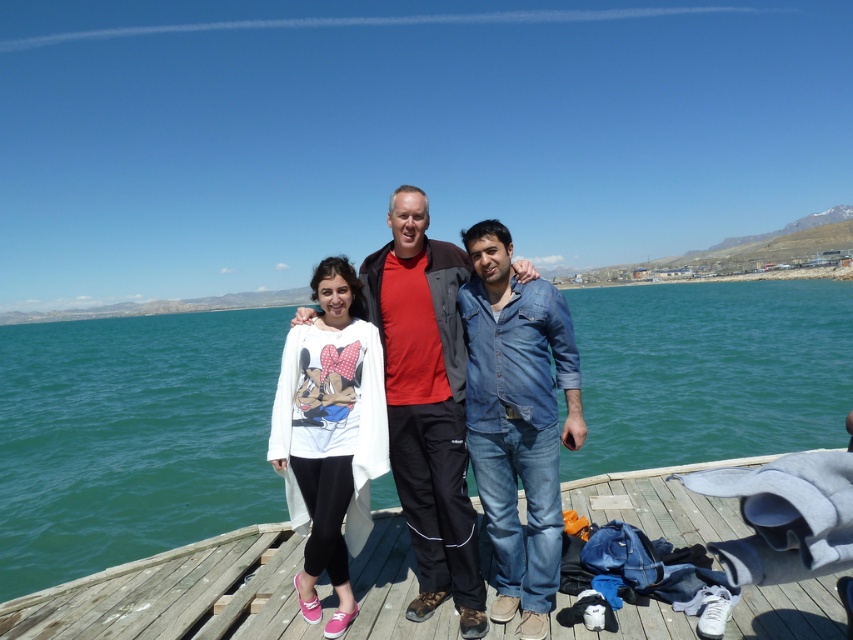
Question: Is denim jeans at lower right above red cotton shirt at center?

Choices:
 (A) yes
 (B) no

Answer: (B)

Question: Does wooden at center have a lesser width compared to denim jeans at lower right?

Choices:
 (A) no
 (B) yes

Answer: (B)

Question: Which point is closer to the camera?

Choices:
 (A) pos(401,470)
 (B) pos(33,342)

Answer: (A)

Question: Where is green water at center located in relation to red cotton shirt at center in the image?

Choices:
 (A) above
 (B) below

Answer: (A)

Question: Which point is closer to the camera taking this photo?

Choices:
 (A) (276, 628)
 (B) (376, 256)

Answer: (A)

Question: Among these points, which one is farthest from the camera?

Choices:
 (A) (282, 429)
 (B) (407, 554)

Answer: (B)